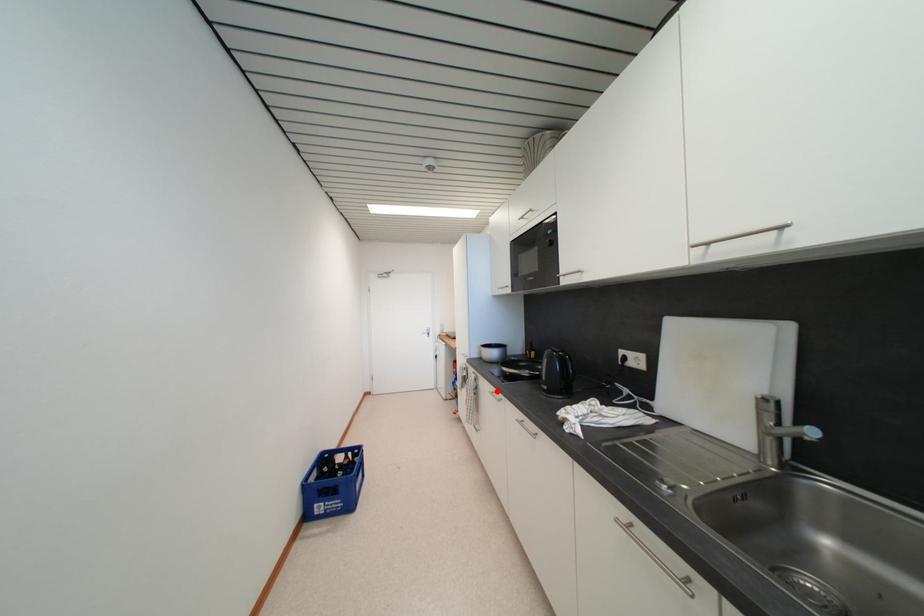
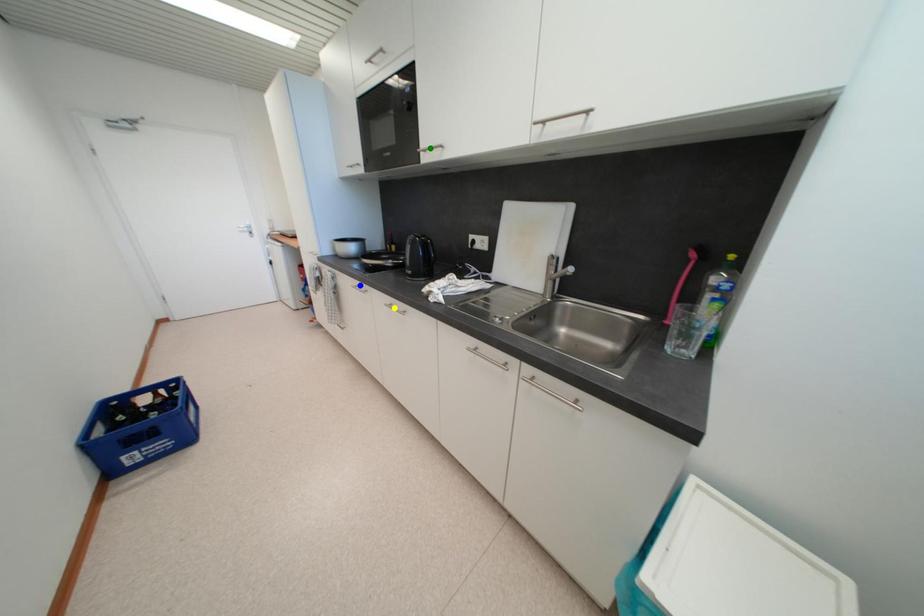
Question: I am providing you with two images of the same scene from different viewpoints. A red point is marked on the first image. You are given multiple points on the second image. Which mark in image 2 goes with the point in image 1?

Choices:
 (A) green point
 (B) yellow point
 (C) blue point

Answer: (C)